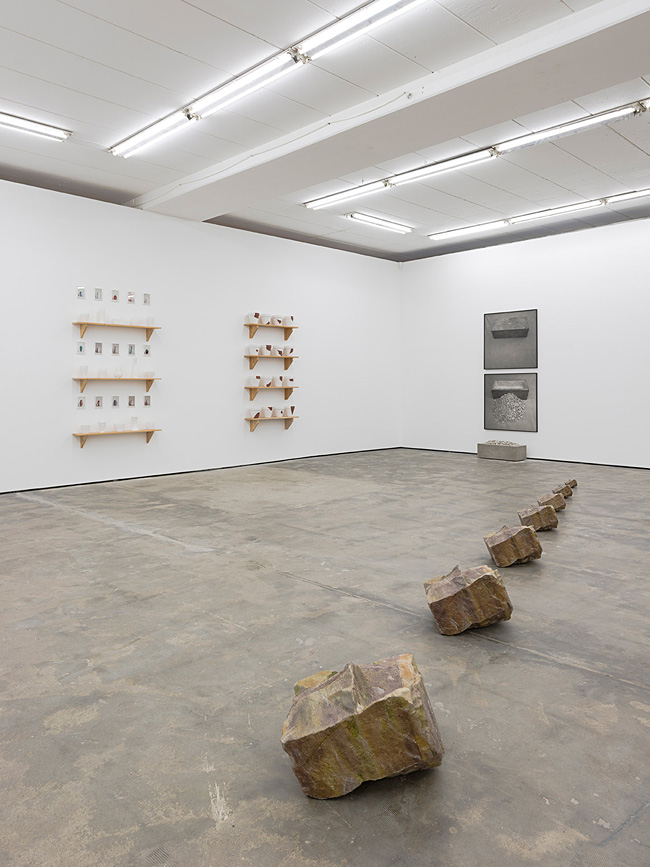
Identify the location of beam. The height and width of the screenshot is (867, 650). (361, 134).